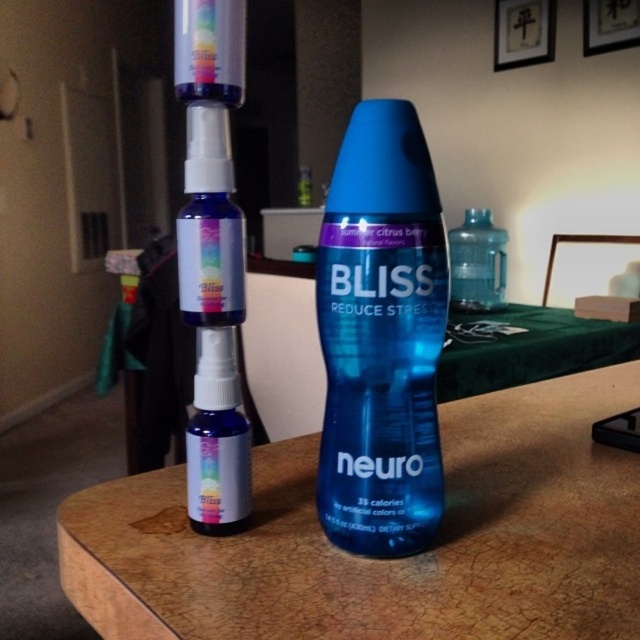
You are organizing a wellness fair and need to place a decorative plant on the matte plastic table at center. However, there is a blue matte spray bottle at center on the table. Where should you place the plant to ensure it doesn not interfere with the spray bottle?

The matte plastic table at center is located below the blue matte spray bottle at center, so placing the plant on the table would not interfere with the spray bottle since it is positioned below it.

Looking at this image, you are organizing a display for a wellness fair and need to ensure that the matte plastic table at center can support the blue glossy bottle at center. Given that the table is shorter than the bottle, will the bottle be able to stand upright on the table?

The matte plastic table at center has a lesser height compared to blue glossy bottle at center, so the bottle will still be able to stand upright on the table as the table height does not affect the bottle stability.

You are organizing a small desk and need to place both the matte plastic table at center and the matte glass spray bottle at center. Since you want to ensure stability, which object should you place at the bottom?

The matte plastic table at center is bigger than the matte glass spray bottle at center, so placing the matte plastic table at center at the bottom would provide a stable base.